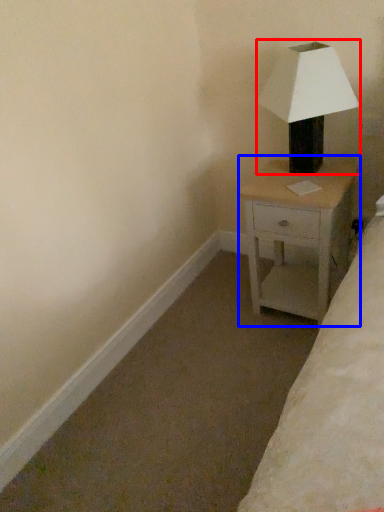
Question: Which object is further to the camera taking this photo, lamp (highlighted by a red box) or nightstand (highlighted by a blue box)?

Choices:
 (A) lamp
 (B) nightstand

Answer: (B)